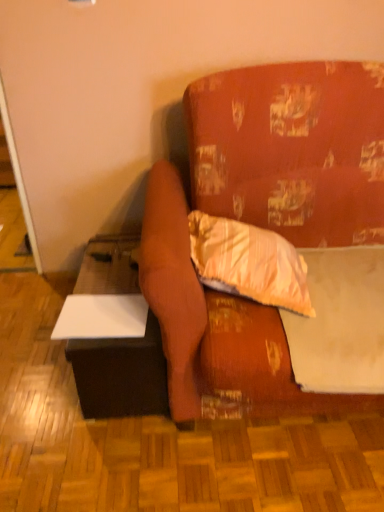
Question: Is white matte sheet at upper right turned away from striped fabric pillow at center?

Choices:
 (A) no
 (B) yes

Answer: (A)

Question: Does white matte sheet at upper right come behind striped fabric pillow at center?

Choices:
 (A) yes
 (B) no

Answer: (B)

Question: Is white matte sheet at upper right placed right next to striped fabric pillow at center?

Choices:
 (A) no
 (B) yes

Answer: (A)

Question: Does white matte sheet at upper right have a lesser width compared to striped fabric pillow at center?

Choices:
 (A) no
 (B) yes

Answer: (A)

Question: From a real-world perspective, is white matte sheet at upper right located higher than striped fabric pillow at center?

Choices:
 (A) yes
 (B) no

Answer: (B)

Question: Considering the relative positions of white matte sheet at upper right and striped fabric pillow at center in the image provided, is white matte sheet at upper right to the left of striped fabric pillow at center from the viewer's perspective?

Choices:
 (A) no
 (B) yes

Answer: (A)

Question: Is striped fabric pillow at center wider than white matte table at lower left?

Choices:
 (A) no
 (B) yes

Answer: (A)

Question: Considering the relative sizes of striped fabric pillow at center and white matte table at lower left in the image provided, is striped fabric pillow at center bigger than white matte table at lower left?

Choices:
 (A) yes
 (B) no

Answer: (B)

Question: Can you confirm if striped fabric pillow at center is positioned to the left of white matte table at lower left?

Choices:
 (A) no
 (B) yes

Answer: (A)

Question: Is striped fabric pillow at center further to camera compared to white matte table at lower left?

Choices:
 (A) no
 (B) yes

Answer: (A)

Question: Is striped fabric pillow at center oriented away from white matte table at lower left?

Choices:
 (A) yes
 (B) no

Answer: (B)

Question: From the image's perspective, is striped fabric pillow at center on white matte table at lower left?

Choices:
 (A) yes
 (B) no

Answer: (A)

Question: Is striped fabric pillow at center located outside white matte sheet at upper right?

Choices:
 (A) no
 (B) yes

Answer: (B)